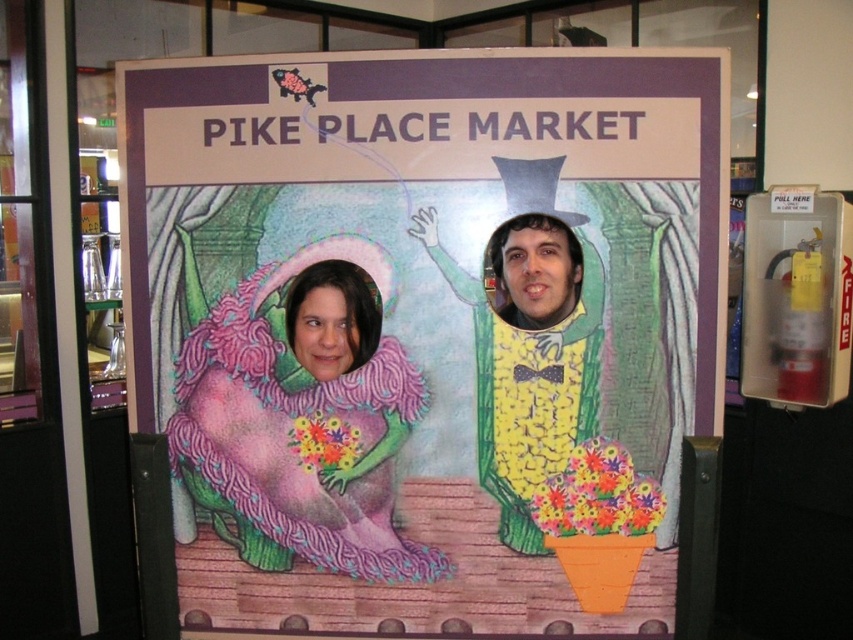
You are a photographer at Pike Place Market. You want to take a photo of the photo booth setup. Which object, the pink fuzzy dress at center or the smooth yellow corn at center, will appear closer to the camera in the photo?

The pink fuzzy dress at center will appear closer to the camera in the photo because the smooth yellow corn at center is behind it.

You are a photographer setting up a photo shoot at Pike Place Market. You need to place a small decorative flower pot that is 15 cm in diameter between the pink fuzzy dress at center and the smooth yellow corn at center. Considering their sizes, which object should the flower pot be placed closer to?

The pink fuzzy dress at center is larger than the smooth yellow corn at center. Therefore, the flower pot should be placed closer to the smooth yellow corn at center to maintain balance between the two objects.